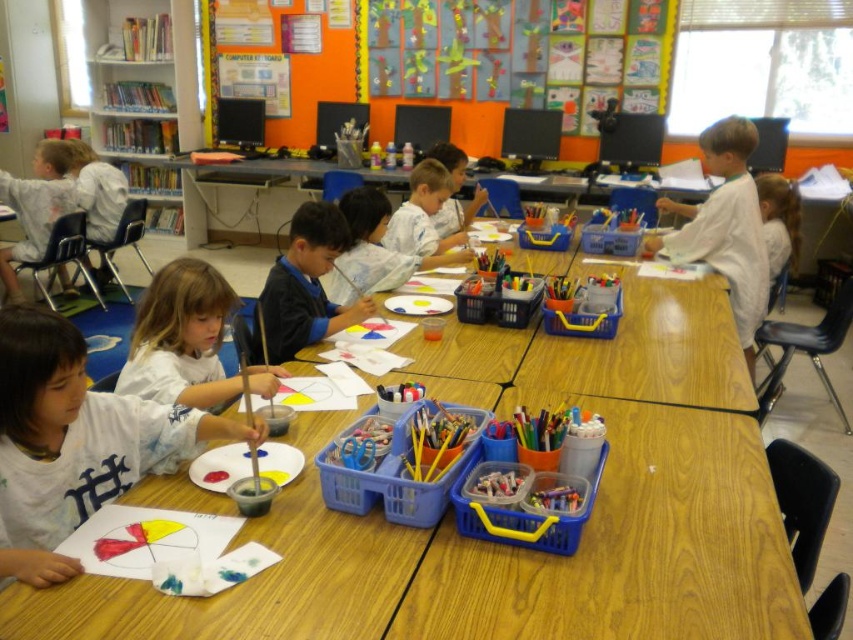
Question: Can you confirm if dark blue sweater at center is bigger than smooth white shirt at center?

Choices:
 (A) no
 (B) yes

Answer: (B)

Question: Estimate the real-world distances between objects in this image. Which object is closer to the wooden table at center?

Choices:
 (A) matte white shirt at lower left
 (B) white paper at right
 (C) matte white shirt at center

Answer: (A)

Question: Does wooden table at center have a larger size compared to colorful paper art at upper center?

Choices:
 (A) no
 (B) yes

Answer: (B)

Question: Which point is farther to the camera?

Choices:
 (A) white paper at left
 (B) colorful paper art at upper center
 (C) smooth white shirt at center
 (D) white paper at right

Answer: (B)

Question: In this image, where is white paper at left located relative to smooth white shirt at center?

Choices:
 (A) above
 (B) below

Answer: (B)

Question: Which of these objects is positioned farthest from the white paper at right?

Choices:
 (A) matte white shirt at lower left
 (B) matte white shirt at center
 (C) colorful paper art at upper center

Answer: (A)